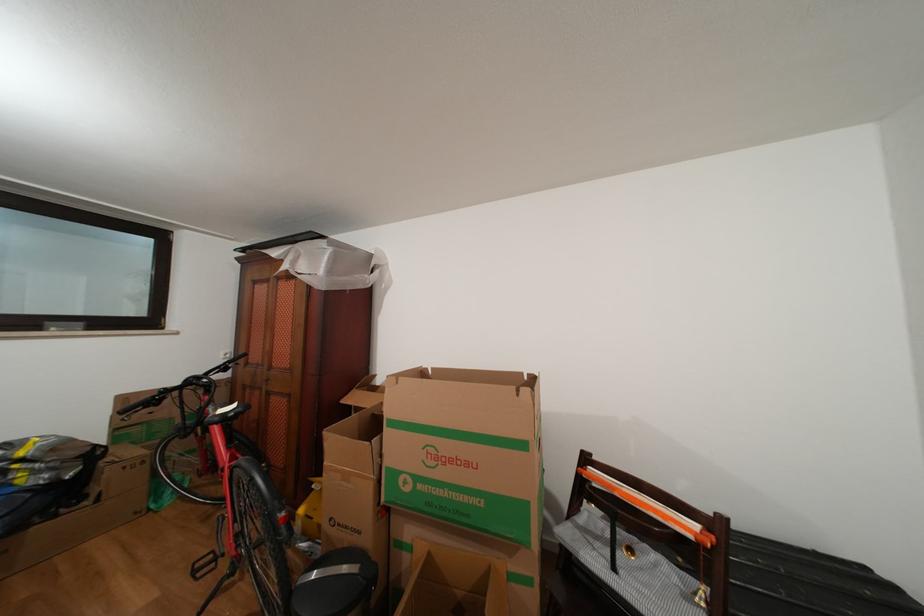
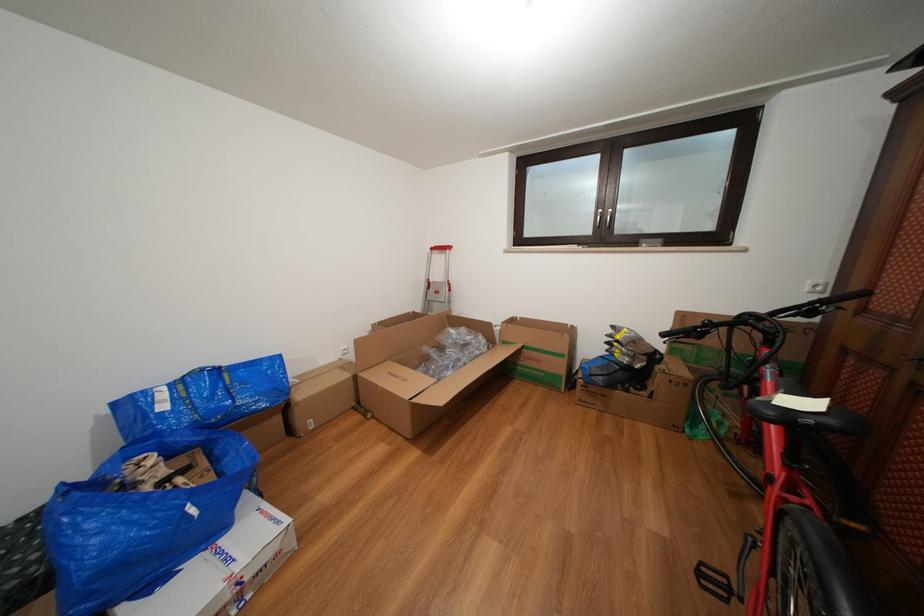
In the second image, find the point that corresponds to pixel 202 578 in the first image.

(708, 578)